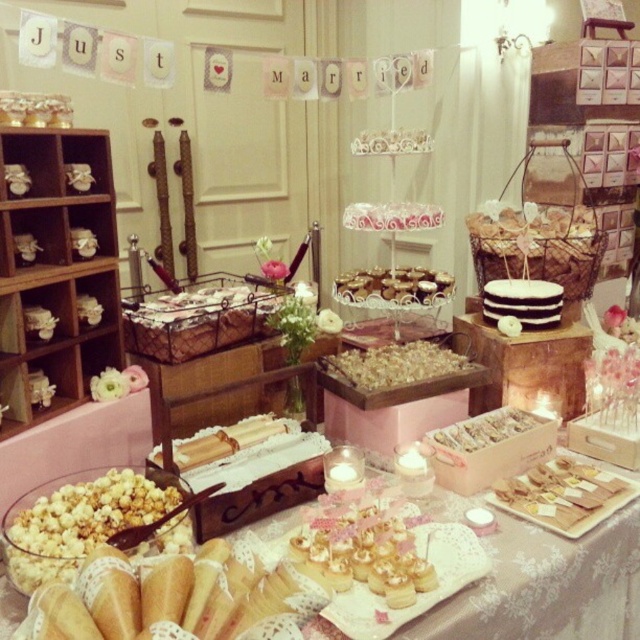
Between pink frosted cupcakes at center and chocolate frosted cake at center, which one has more height?

Standing taller between the two is chocolate frosted cake at center.

Describe the element at coordinates (365, 556) in the screenshot. I see `pink frosted cupcakes at center` at that location.

This screenshot has height=640, width=640. What are the coordinates of `pink frosted cupcakes at center` in the screenshot? It's located at (365, 556).

Locate an element on the screen. pink frosted cupcakes at center is located at coordinates (365, 556).

From the picture: Does white lace tablecloth at center have a greater width compared to chocolate frosted cake at center?

Yes.

The height and width of the screenshot is (640, 640). Identify the location of white lace tablecloth at center. (547, 586).

Does point (152, 502) come farther from viewer compared to point (387, 364)?

No, it is in front of (387, 364).

Where is `caramel popcorn at center`? This screenshot has height=640, width=640. caramel popcorn at center is located at coordinates (76, 520).